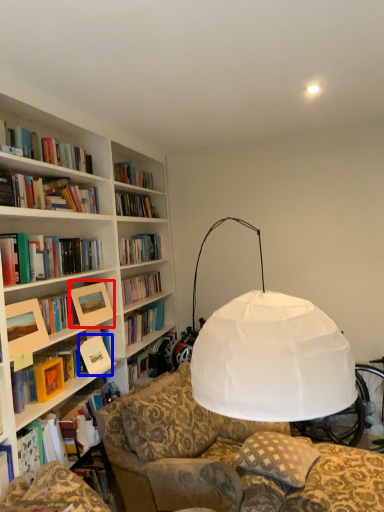
Question: Which of the following is the closest to the observer, picture frame (highlighted by a red box) or paperback book (highlighted by a blue box)?

Choices:
 (A) picture frame
 (B) paperback book

Answer: (A)